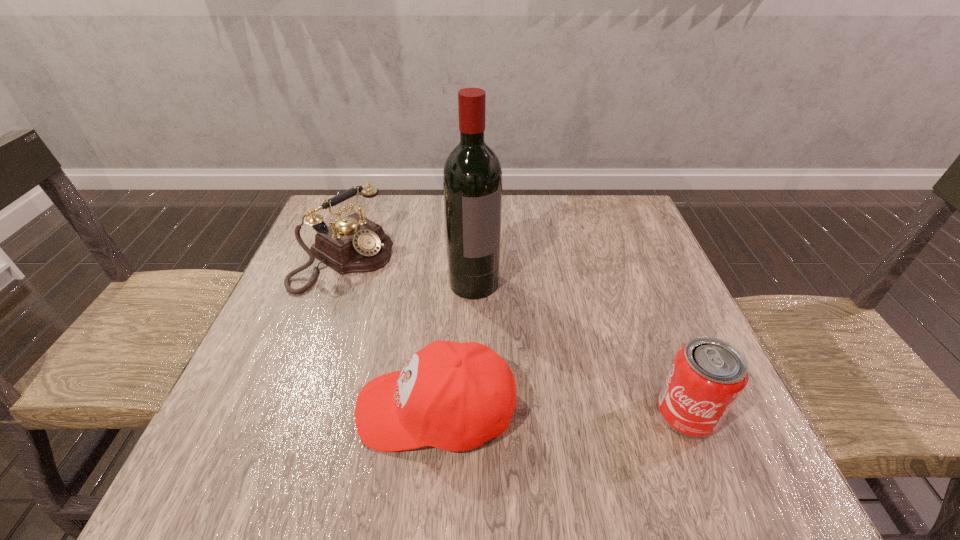
Locate an element on the screen. The image size is (960, 540). free space that is in between the telephone and the baseball cap is located at coordinates (390, 333).

Identify the location of unoccupied area between the can and the tallest object. This screenshot has width=960, height=540. (581, 348).

This screenshot has width=960, height=540. I want to click on vacant space that's between the can and the tallest object, so click(x=581, y=348).

Find the location of `vacant space that is in between the baseball cap and the leftmost object`. vacant space that is in between the baseball cap and the leftmost object is located at coordinates (390, 333).

Image resolution: width=960 pixels, height=540 pixels. I want to click on free spot between the can and the wine bottle, so click(581, 348).

Where is `free space between the rightmost object and the baseball cap`? This screenshot has width=960, height=540. free space between the rightmost object and the baseball cap is located at coordinates click(562, 411).

Where is `free space that is in between the baseball cap and the telephone`? Image resolution: width=960 pixels, height=540 pixels. free space that is in between the baseball cap and the telephone is located at coordinates [x=390, y=333].

This screenshot has width=960, height=540. I want to click on object that is the closest one to the wine bottle, so click(x=354, y=244).

This screenshot has height=540, width=960. I want to click on object that ranks as the third closest to the baseball cap, so click(707, 376).